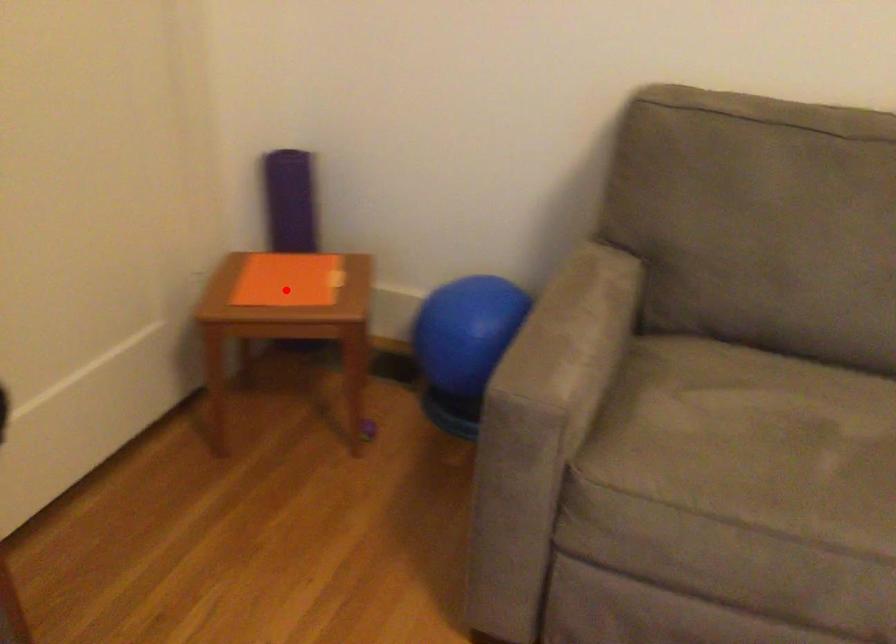
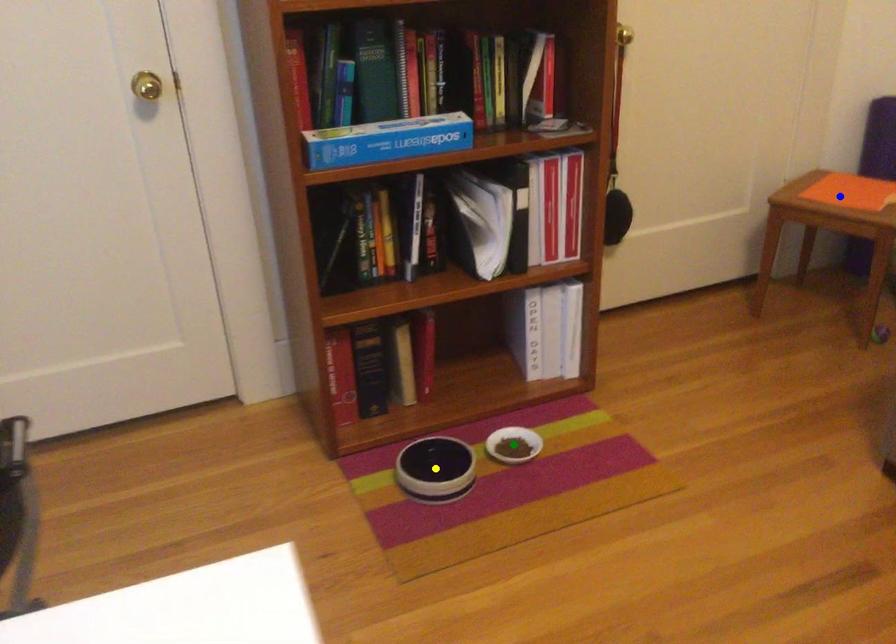
Question: I am providing you with two images of the same scene from different viewpoints. A red point is marked on the first image. You are given multiple points on the second image. Which spot in image 2 lines up with the point in image 1?

Choices:
 (A) yellow point
 (B) blue point
 (C) green point

Answer: (B)